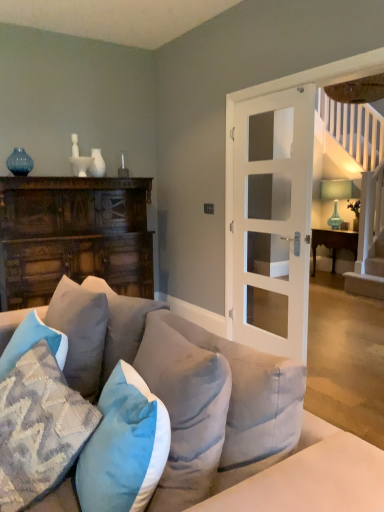
Question: Considering the relative positions of velvet blue couch at center and blue velvet pillow at center, the first pillow when ordered from right to left, in the image provided, is velvet blue couch at center to the right of blue velvet pillow at center, the first pillow when ordered from right to left, from the viewer's perspective?

Choices:
 (A) no
 (B) yes

Answer: (A)

Question: Would you say velvet blue couch at center contains blue velvet pillow at center, the first pillow when ordered from right to left?

Choices:
 (A) yes
 (B) no

Answer: (A)

Question: From a real-world perspective, is velvet blue couch at center under blue velvet pillow at center, the 5th pillow when ordered from left to right?

Choices:
 (A) yes
 (B) no

Answer: (A)

Question: Considering the relative sizes of velvet blue couch at center and blue velvet pillow at center, the first pillow when ordered from right to left, in the image provided, is velvet blue couch at center bigger than blue velvet pillow at center, the first pillow when ordered from right to left,?

Choices:
 (A) yes
 (B) no

Answer: (A)

Question: Is velvet blue couch at center to the left of blue velvet pillow at center, the 5th pillow when ordered from left to right, from the viewer's perspective?

Choices:
 (A) no
 (B) yes

Answer: (B)

Question: Is velvet blue couch at center thinner than blue velvet pillow at center, the 5th pillow when ordered from left to right?

Choices:
 (A) no
 (B) yes

Answer: (A)

Question: Can you confirm if velvet blue couch at center is shorter than wooden table at right?

Choices:
 (A) no
 (B) yes

Answer: (A)

Question: From a real-world perspective, does velvet blue couch at center sit lower than wooden table at right?

Choices:
 (A) no
 (B) yes

Answer: (A)

Question: Is velvet blue couch at center facing away from wooden table at right?

Choices:
 (A) no
 (B) yes

Answer: (A)

Question: Can you confirm if velvet blue couch at center is wider than wooden table at right?

Choices:
 (A) yes
 (B) no

Answer: (A)

Question: Does velvet blue couch at center come in front of wooden table at right?

Choices:
 (A) yes
 (B) no

Answer: (A)

Question: From a real-world perspective, is velvet blue couch at center physically above wooden table at right?

Choices:
 (A) no
 (B) yes

Answer: (B)

Question: From the image's perspective, would you say white glass door at center is shown under dark wood cabinet at left?

Choices:
 (A) no
 (B) yes

Answer: (A)